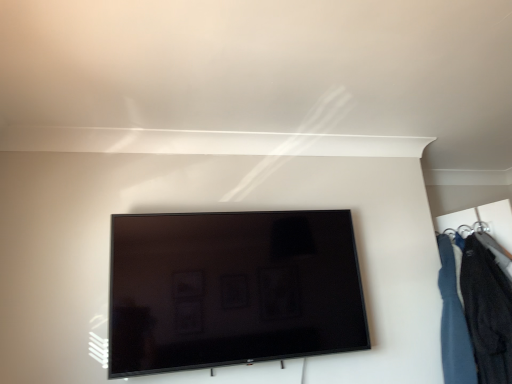
Measure the distance between point (258,320) and camera.

Point (258,320) and camera are 1.80 meters apart.

This screenshot has height=384, width=512. In order to click on black glossy tv at center in this screenshot , I will do `click(232, 289)`.

The height and width of the screenshot is (384, 512). Describe the element at coordinates (232, 289) in the screenshot. I see `black glossy tv at center` at that location.

Where is `velvet dark blue jacket at right`? The width and height of the screenshot is (512, 384). velvet dark blue jacket at right is located at coordinates (474, 312).

What do you see at coordinates (474, 312) in the screenshot? I see `velvet dark blue jacket at right` at bounding box center [474, 312].

You are a GUI agent. You are given a task and a screenshot of the screen. Output one action in this format:
    pyautogui.click(x=<x>, y=<y>)
    Task: Click on the black glossy tv at center
    The width and height of the screenshot is (512, 384).
    Given the screenshot: What is the action you would take?
    pyautogui.click(x=232, y=289)

Does black glossy tv at center appear on the left side of velvet dark blue jacket at right?

Correct, you'll find black glossy tv at center to the left of velvet dark blue jacket at right.

From the picture: Which is in front, black glossy tv at center or velvet dark blue jacket at right?

black glossy tv at center is in front.

Is point (339, 335) positioned in front of point (465, 241)?

Yes.

From the image's perspective, is black glossy tv at center under velvet dark blue jacket at right?

Incorrect, from the image's perspective, black glossy tv at center is higher than velvet dark blue jacket at right.

From a real-world perspective, is black glossy tv at center above or below velvet dark blue jacket at right?

black glossy tv at center is above velvet dark blue jacket at right.

In terms of width, does black glossy tv at center look wider or thinner when compared to velvet dark blue jacket at right?

Considering their sizes, black glossy tv at center looks slimmer than velvet dark blue jacket at right.

Considering the sizes of objects black glossy tv at center and velvet dark blue jacket at right in the image provided, who is shorter, black glossy tv at center or velvet dark blue jacket at right?

With less height is black glossy tv at center.

Between black glossy tv at center and velvet dark blue jacket at right, which one has larger size?

black glossy tv at center is bigger.

Would you say black glossy tv at center is inside or outside velvet dark blue jacket at right?

black glossy tv at center lies outside velvet dark blue jacket at right.

Is black glossy tv at center not near velvet dark blue jacket at right?

black glossy tv at center is near velvet dark blue jacket at right, not far away.

Is black glossy tv at center positioned with its back to velvet dark blue jacket at right?

That's not correct — black glossy tv at center is not looking away from velvet dark blue jacket at right.

How many degrees apart are the facing directions of black glossy tv at center and velvet dark blue jacket at right?

61.4 degrees.

Locate an element on the screen. closet located behind the black glossy tv at center is located at coordinates (474, 312).

Looking at this image, which is more to the right, velvet dark blue jacket at right or black glossy tv at center?

velvet dark blue jacket at right.

Considering the positions of objects velvet dark blue jacket at right and black glossy tv at center in the image provided, who is behind, velvet dark blue jacket at right or black glossy tv at center?

velvet dark blue jacket at right is behind.

Which is less distant, (460, 298) or (348, 292)?

Point (348, 292)

From the image's perspective, is velvet dark blue jacket at right on top of black glossy tv at center?

Actually, velvet dark blue jacket at right appears below black glossy tv at center in the image.

From a real-world perspective, is velvet dark blue jacket at right on top of black glossy tv at center?

Actually, velvet dark blue jacket at right is physically below black glossy tv at center in the real world.

Looking at their sizes, would you say velvet dark blue jacket at right is wider or thinner than black glossy tv at center?

Clearly, velvet dark blue jacket at right has more width compared to black glossy tv at center.

Looking at this image, considering the sizes of velvet dark blue jacket at right and black glossy tv at center in the image, is velvet dark blue jacket at right taller or shorter than black glossy tv at center?

In the image, velvet dark blue jacket at right appears to be taller than black glossy tv at center.

Considering the sizes of objects velvet dark blue jacket at right and black glossy tv at center in the image provided, who is smaller, velvet dark blue jacket at right or black glossy tv at center?

With smaller size is velvet dark blue jacket at right.

Is velvet dark blue jacket at right spatially inside black glossy tv at center, or outside of it?

velvet dark blue jacket at right is located beyond the bounds of black glossy tv at center.

Is velvet dark blue jacket at right with black glossy tv at center?

There is a gap between velvet dark blue jacket at right and black glossy tv at center.

Is velvet dark blue jacket at right looking in the opposite direction of black glossy tv at center?

No, velvet dark blue jacket at right is not facing the opposite direction of black glossy tv at center.

What's the angular difference between velvet dark blue jacket at right and black glossy tv at center's facing directions?

The facing directions of velvet dark blue jacket at right and black glossy tv at center are 61.4 degrees apart.

How much distance is there between velvet dark blue jacket at right and black glossy tv at center?

The distance of velvet dark blue jacket at right from black glossy tv at center is 84.14 centimeters.

At what (x,y) coordinates should I click in order to perform the action: click on closet that is under the black glossy tv at center (from a real-world perspective). Please return your answer as a coordinate pair (x, y). Looking at the image, I should click on (474, 312).

At what (x,y) coordinates should I click in order to perform the action: click on television that appears above the velvet dark blue jacket at right (from a real-world perspective). Please return your answer as a coordinate pair (x, y). The width and height of the screenshot is (512, 384). Looking at the image, I should click on (232, 289).

Where is `closet beneath the black glossy tv at center (from a real-world perspective)`? The height and width of the screenshot is (384, 512). closet beneath the black glossy tv at center (from a real-world perspective) is located at coordinates (474, 312).